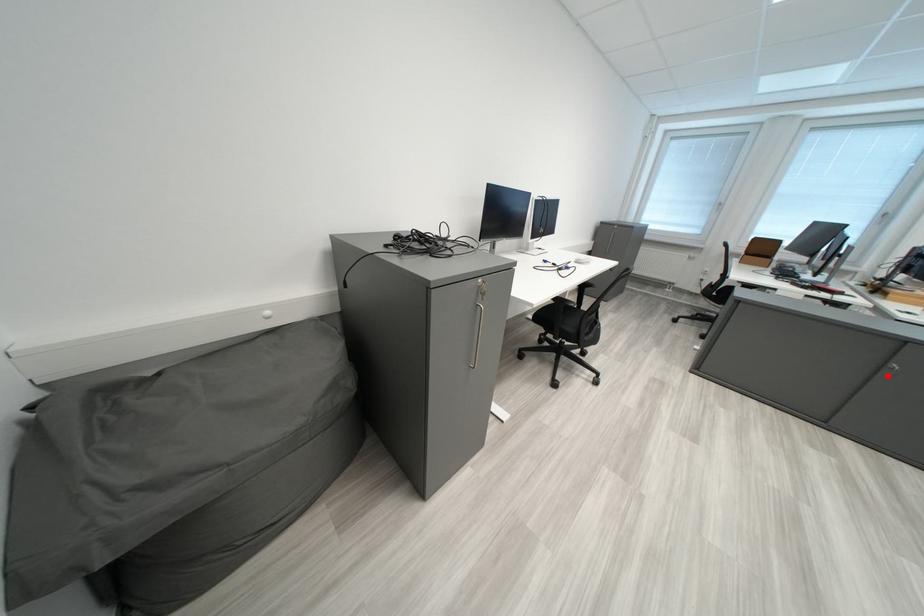
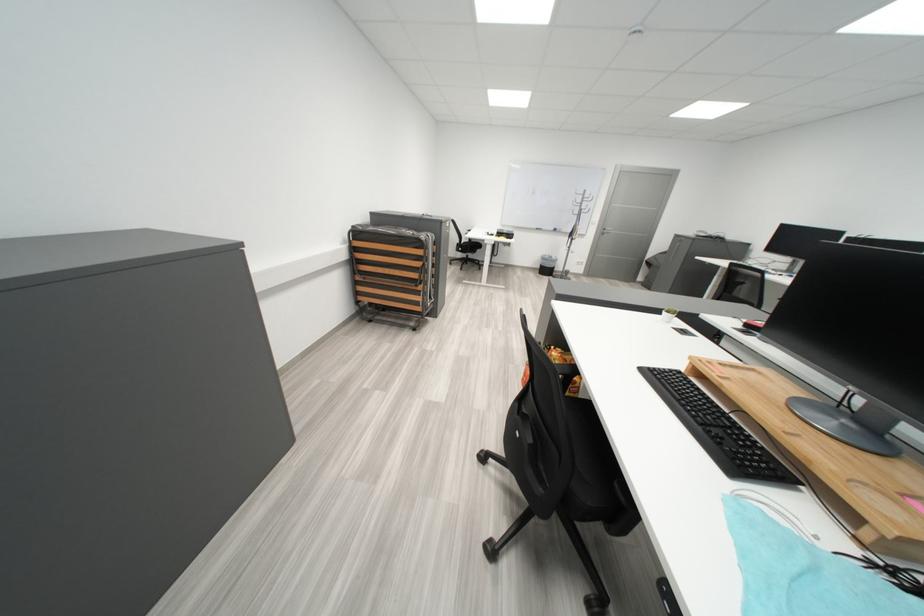
Question: I am providing you with two images of the same scene from different viewpoints. A red point is marked on the first image. Can you still see the location of the red point in image 2?

Choices:
 (A) Yes
 (B) No

Answer: (B)